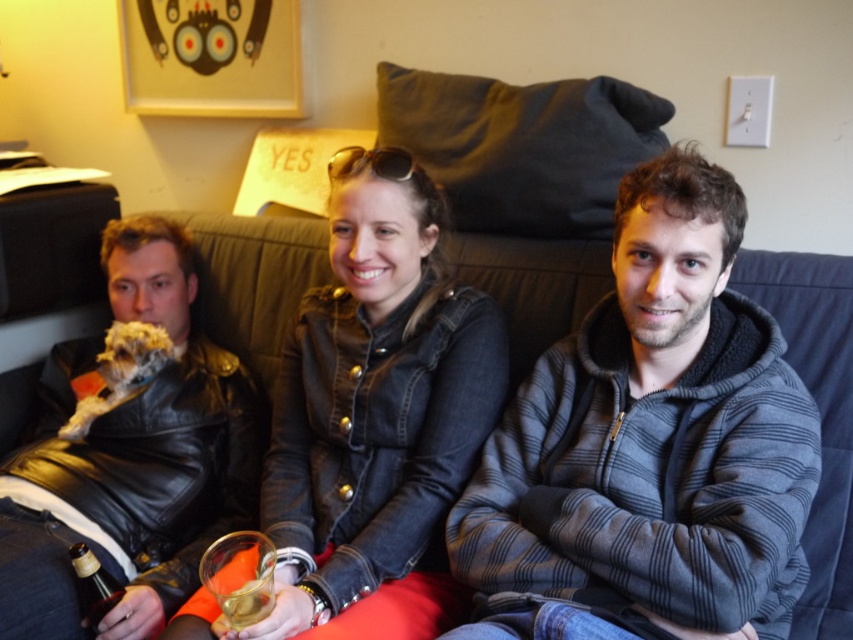
You are standing at the point marked by coordinates point (520, 410) in the image. You want to take a photo of the three people on the couch using a camera that has a maximum focus range of 4.5 feet. Will the camera be able to focus on the three people on the couch?

The point marked by coordinates point (520, 410) and the camera are 4.40 feet apart from each other. Since the camera has a maximum focus range of 4.5 feet, the camera can focus on the three people on the couch as they are within the focus range.

You are a photographer setting up for a group photo. You notice the leather jacket at left and the fluffy white dog at left in the scene. Which object is closer to the camera?

The fluffy white dog at left is closer to the camera because the leather jacket at left is positioned under it, meaning the dog is above the jacket in the frame.

You are standing in front of the couch and want to hand a gift to the person wearing the gray striped hoodie at center and the denim jacket at center. Which person should you approach first based on their proximity to you?

The gray striped hoodie at center is closer to the viewer than the denim jacket at center, so you should approach the person wearing the gray striped hoodie at center first.